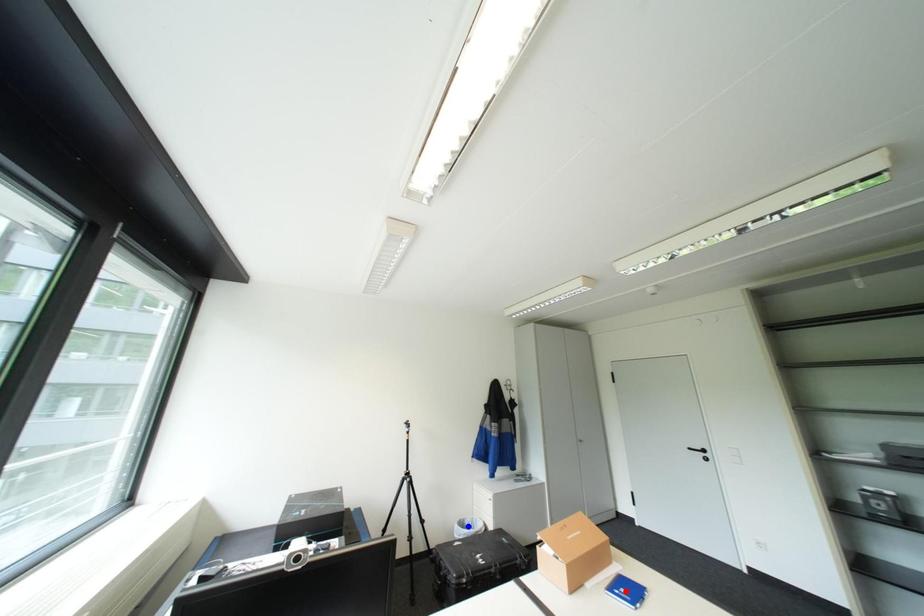
Question: Which of the two points in the image is closer to the camera?

Choices:
 (A) Blue point is closer.
 (B) Red point is closer.

Answer: (B)